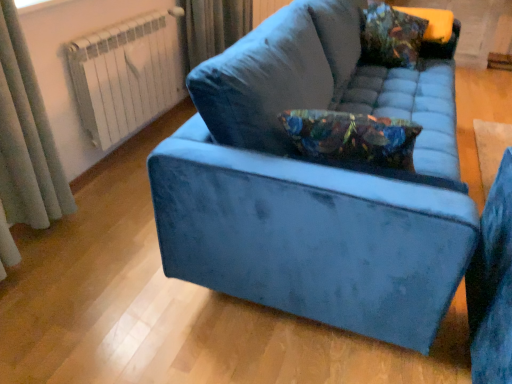
Question: Is white metal radiator at upper left further to camera compared to gray fabric curtain at left?

Choices:
 (A) no
 (B) yes

Answer: (B)

Question: Is white metal radiator at upper left wider than gray fabric curtain at left?

Choices:
 (A) no
 (B) yes

Answer: (A)

Question: From the image's perspective, is white metal radiator at upper left located beneath gray fabric curtain at left?

Choices:
 (A) no
 (B) yes

Answer: (A)

Question: Would you consider white metal radiator at upper left to be distant from gray fabric curtain at left?

Choices:
 (A) no
 (B) yes

Answer: (A)

Question: Is white metal radiator at upper left beside gray fabric curtain at left?

Choices:
 (A) yes
 (B) no

Answer: (B)

Question: Is white metal radiator at upper left closer to camera compared to gray fabric curtain at left?

Choices:
 (A) no
 (B) yes

Answer: (A)

Question: Does floral-patterned velvet pillow at upper right have a smaller size compared to velvet blue couch at center?

Choices:
 (A) no
 (B) yes

Answer: (B)

Question: Are floral-patterned velvet pillow at upper right and velvet blue couch at center far apart?

Choices:
 (A) yes
 (B) no

Answer: (B)

Question: Would you say velvet blue couch at center is part of floral-patterned velvet pillow at upper right's contents?

Choices:
 (A) yes
 (B) no

Answer: (B)

Question: Considering the relative positions of floral-patterned velvet pillow at upper right and velvet blue couch at center in the image provided, is floral-patterned velvet pillow at upper right behind velvet blue couch at center?

Choices:
 (A) no
 (B) yes

Answer: (B)

Question: Does floral-patterned velvet pillow at upper right have a lesser height compared to velvet blue couch at center?

Choices:
 (A) no
 (B) yes

Answer: (B)

Question: Is floral-patterned velvet pillow at upper right taller than velvet blue couch at center?

Choices:
 (A) yes
 (B) no

Answer: (B)

Question: Is gray fabric curtain at left positioned far away from velvet blue couch at center?

Choices:
 (A) yes
 (B) no

Answer: (A)